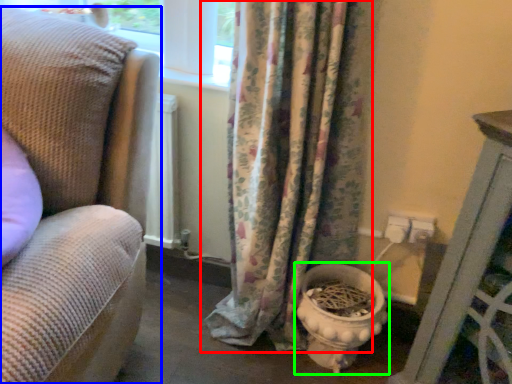
Question: Estimate the real-world distances between objects in this image. Which object is farther from curtain (highlighted by a red box), studio couch (highlighted by a blue box) or toilet bowl (highlighted by a green box)?

Choices:
 (A) studio couch
 (B) toilet bowl

Answer: (A)